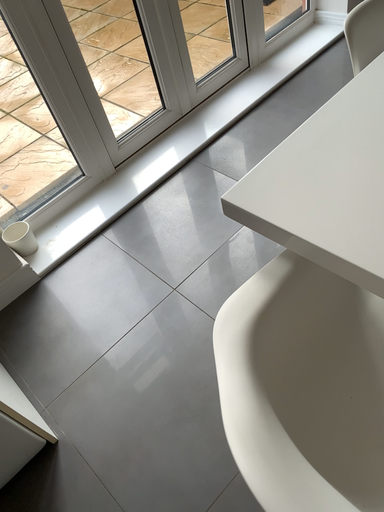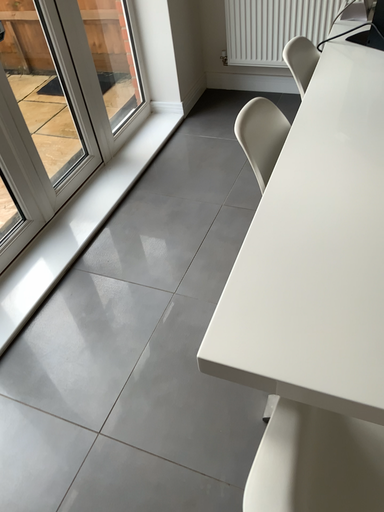
Question: Which way did the camera rotate in the video?

Choices:
 (A) rotated right
 (B) rotated left

Answer: (A)